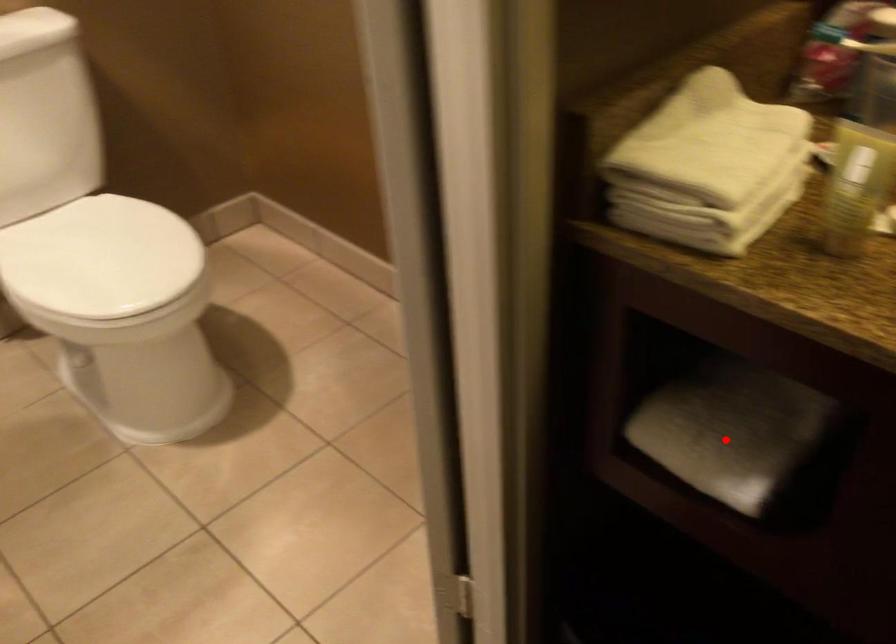
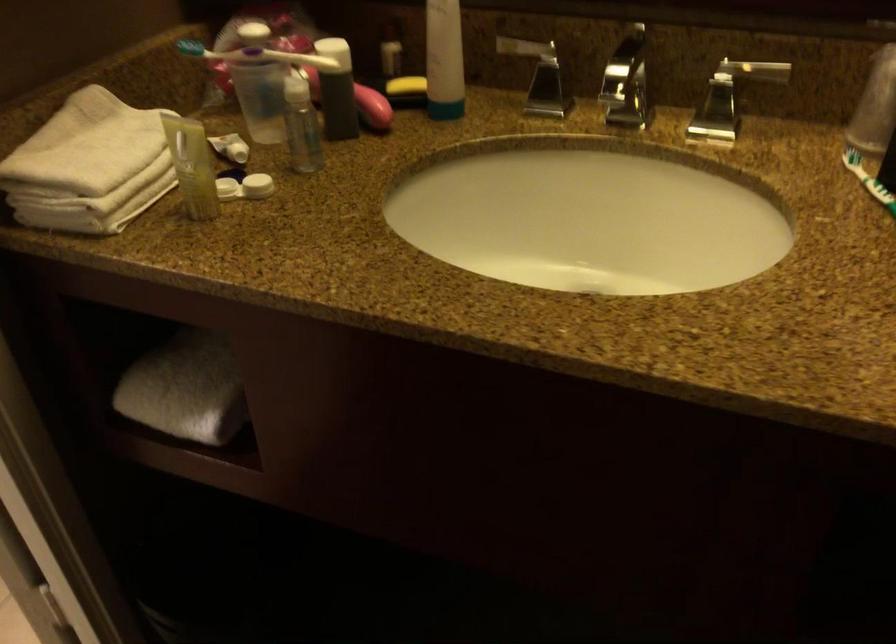
Question: I am providing you with two images of the same scene from different viewpoints. In image1, a red point is highlighted. Considering the same 3D point in image2, which of the following is correct?

Choices:
 (A) It is closer
 (B) It is farther

Answer: (B)